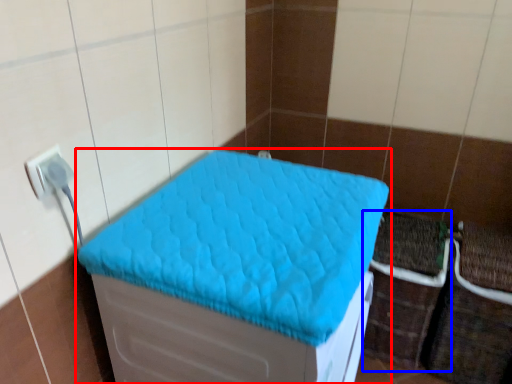
Question: Which object appears closest to the camera in this image, furniture (highlighted by a red box) or crate (highlighted by a blue box)?

Choices:
 (A) furniture
 (B) crate

Answer: (A)